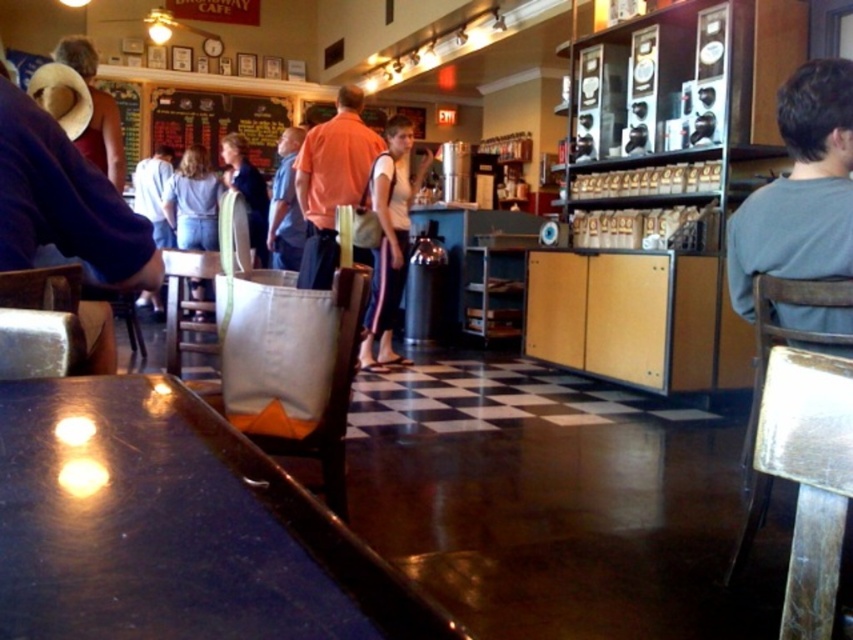
Does shiny dark wood table at center have a greater width compared to matte brown hat at upper left?

No, shiny dark wood table at center is not wider than matte brown hat at upper left.

What do you see at coordinates (173, 528) in the screenshot? This screenshot has height=640, width=853. I see `shiny dark wood table at center` at bounding box center [173, 528].

Where is `shiny dark wood table at center`? shiny dark wood table at center is located at coordinates [173, 528].

Does shiny dark wood table at center have a lesser height compared to metallic silver table at lower right?

Indeed, shiny dark wood table at center has a lesser height compared to metallic silver table at lower right.

Does shiny dark wood table at center appear on the left side of metallic silver table at lower right?

Correct, you'll find shiny dark wood table at center to the left of metallic silver table at lower right.

Who is more forward, (38, 449) or (827, 380)?

Point (38, 449) is more forward.

At what (x,y) coordinates should I click in order to perform the action: click on shiny dark wood table at center. Please return your answer as a coordinate pair (x, y). Looking at the image, I should click on (173, 528).

Is point (248, 618) positioned behind point (248, 163)?

No, it is in front of (248, 163).

Which is behind, point (3, 476) or point (262, 260)?

The point (262, 260) is more distant.

Is point (74, 454) farther from camera compared to point (238, 140)?

No, (74, 454) is in front of (238, 140).

You are a GUI agent. You are given a task and a screenshot of the screen. Output one action in this format:
    pyautogui.click(x=<x>, y=<y>)
    Task: Click on the shiny dark wood table at center
    The image size is (853, 640).
    Given the screenshot: What is the action you would take?
    (173, 528)